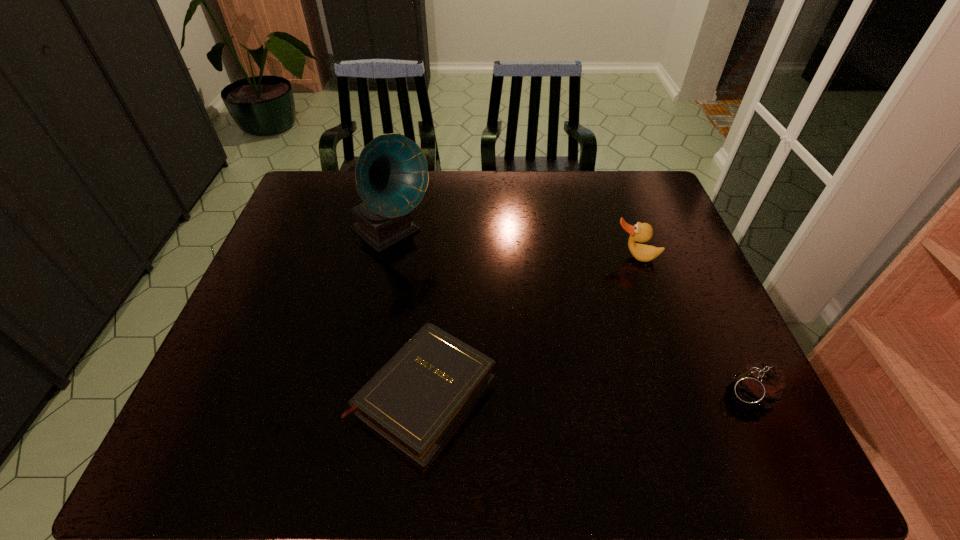
Image resolution: width=960 pixels, height=540 pixels. Identify the location of object that is at the near right corner. (762, 385).

You are a GUI agent. You are given a task and a screenshot of the screen. Output one action in this format:
    pyautogui.click(x=<x>, y=<y>)
    Task: Click on the vacant space at the far edge of the desktop
    Image resolution: width=960 pixels, height=540 pixels.
    Given the screenshot: What is the action you would take?
    pyautogui.click(x=352, y=204)

In the image, there is a desktop. In order to click on blank space at the near edge in this screenshot , I will do `click(636, 410)`.

Where is `free space at the left edge of the desktop`? This screenshot has height=540, width=960. free space at the left edge of the desktop is located at coordinates (291, 243).

You are a GUI agent. You are given a task and a screenshot of the screen. Output one action in this format:
    pyautogui.click(x=<x>, y=<y>)
    Task: Click on the vacant space at the right edge of the desktop
    This screenshot has height=540, width=960.
    Given the screenshot: What is the action you would take?
    pyautogui.click(x=672, y=318)

In the image, there is a desktop. Where is `free region at the far right corner`? free region at the far right corner is located at coordinates (642, 205).

In order to click on unoccupied area between the Bible and the duck in this screenshot , I will do `click(529, 326)`.

Where is `unoccupied position between the rightmost object and the duck`? This screenshot has height=540, width=960. unoccupied position between the rightmost object and the duck is located at coordinates (691, 325).

This screenshot has width=960, height=540. Identify the location of free space between the Bible and the third tallest object. (586, 393).

I want to click on vacant space in between the tallest object and the second shortest object, so click(569, 313).